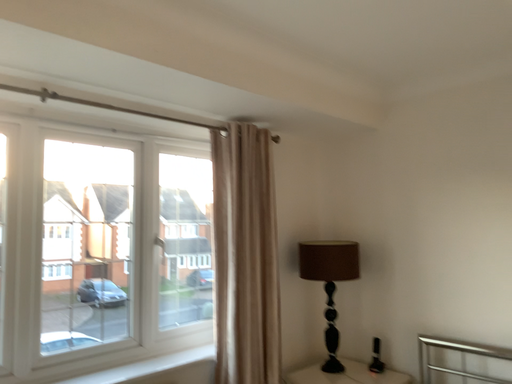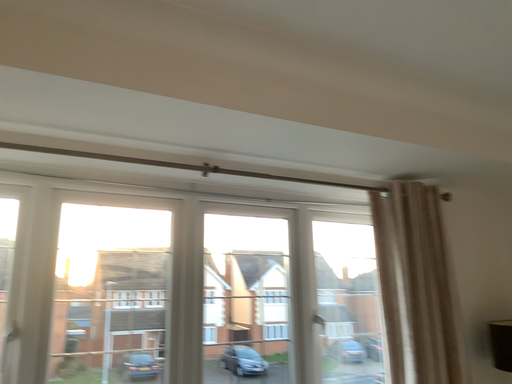
Question: How did the camera likely rotate when shooting the video?

Choices:
 (A) rotated downward
 (B) rotated upward

Answer: (B)